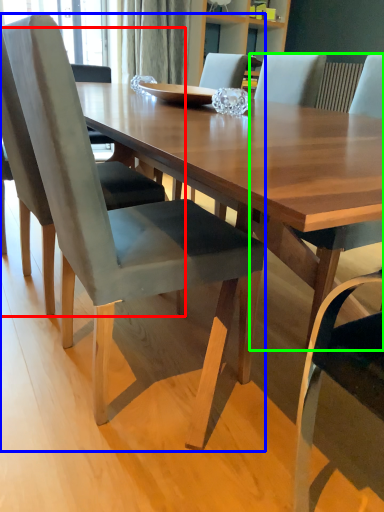
Question: Considering the real-world distances, which object is farthest from chair (highlighted by a red box)? chair (highlighted by a blue box) or chair (highlighted by a green box)?

Choices:
 (A) chair
 (B) chair

Answer: (B)